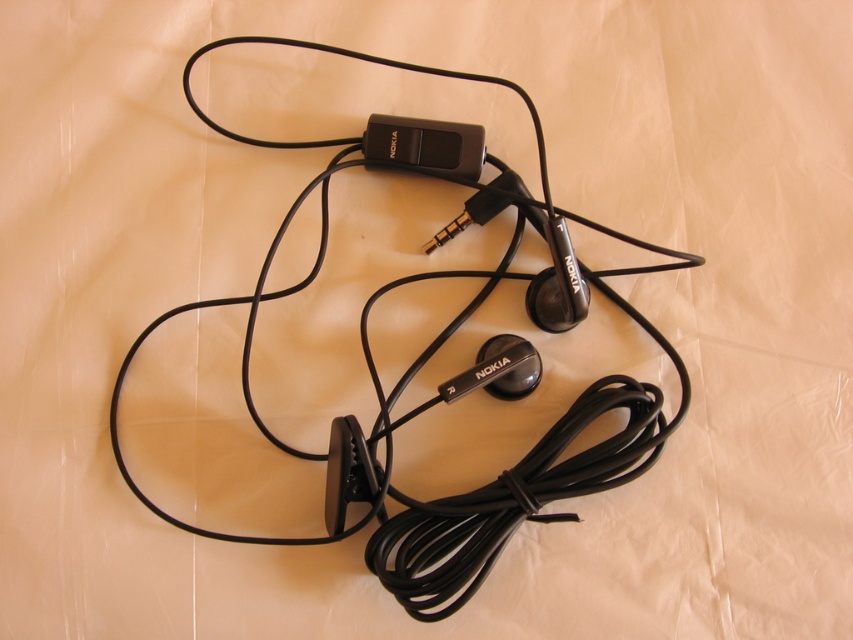
Question: Does black rubber cable at center appear under black plastic ipod at center?

Choices:
 (A) yes
 (B) no

Answer: (A)

Question: Does black rubber cable at center lie in front of black plastic ipod at center?

Choices:
 (A) no
 (B) yes

Answer: (B)

Question: Which object appears farthest from the camera in this image?

Choices:
 (A) black plastic ipod at center
 (B) black rubber cable at center

Answer: (A)

Question: In this image, where is black rubber cable at center located relative to black plastic ipod at center?

Choices:
 (A) above
 (B) below

Answer: (B)

Question: Which point is closer to the camera?

Choices:
 (A) black rubber cable at center
 (B) black plastic ipod at center

Answer: (A)